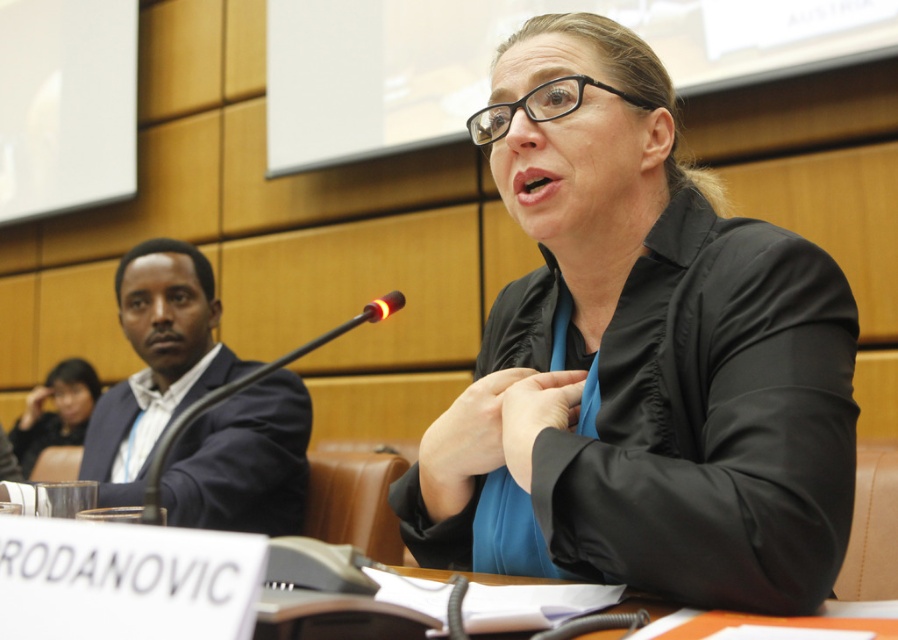
Question: Among these objects, which one is farthest from the camera?

Choices:
 (A) black plastic microphone at center
 (B) matte black laptop at upper left
 (C) black matte blazer at center
 (D) orange paper at lower center

Answer: (B)

Question: Does black matte blazer at center appear on the left side of black plastic microphone at center?

Choices:
 (A) yes
 (B) no

Answer: (B)

Question: Estimate the real-world distances between objects in this image. Which object is closer to the black matte blazer at center?

Choices:
 (A) matte black laptop at upper left
 (B) black plastic microphone at center

Answer: (B)

Question: Is black matte blazer at center further to the viewer compared to matte black laptop at upper left?

Choices:
 (A) no
 (B) yes

Answer: (A)

Question: Is matte black laptop at upper left wider than black plastic microphone at center?

Choices:
 (A) yes
 (B) no

Answer: (B)

Question: Which point is closer to the camera?

Choices:
 (A) (56, 385)
 (B) (379, 301)

Answer: (B)